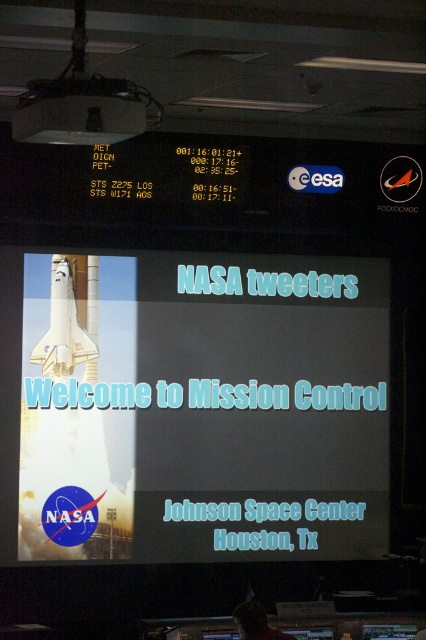
Based on the scene at NASA Mission Control, which object, the white glossy rocket at center or the white matte shuttle at center, has a larger width?

The white glossy rocket at center might be wider than the white matte shuttle at center according to the description.

You are an astronaut preparing for a launch simulation. You see the white glossy rocket at center and the white matte shuttle at center on the NASA presentation screen. Which object appears nearer to you on the screen?

The white glossy rocket at center appears nearer to you because it is closer to the viewer than the white matte shuttle at center according to the description.

You are an astronaut preparing for a launch and see the NASA tweeters slide displayed on the screen. Which object, the white glossy rocket at center or the white matte shuttle at center, would you estimate is taller based on the slide?

The white glossy rocket at center is much taller than the white matte shuttle at center.